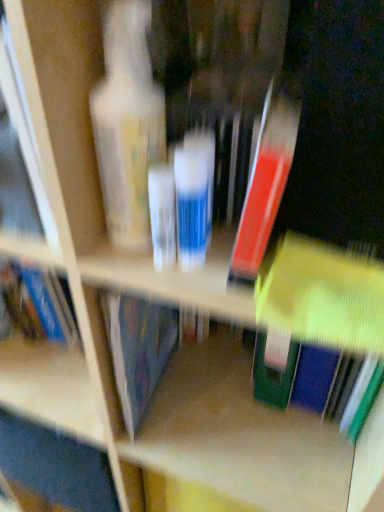
Question: Is matte red book at center, marked as the 2th book in a bottom-to-top arrangement, located outside matte plastic bottle at left?

Choices:
 (A) yes
 (B) no

Answer: (A)

Question: Is matte red book at center, marked as the 2th book in a bottom-to-top arrangement, closer to camera compared to matte plastic bottle at left?

Choices:
 (A) no
 (B) yes

Answer: (B)

Question: Is matte plastic bottle at left inside matte red book at center, marked as the 2th book in a bottom-to-top arrangement?

Choices:
 (A) yes
 (B) no

Answer: (B)

Question: Does matte red book at center, marked as the 2th book in a bottom-to-top arrangement, have a lesser height compared to matte plastic bottle at left?

Choices:
 (A) no
 (B) yes

Answer: (B)

Question: Can you confirm if matte red book at center, marked as the 2th book in a bottom-to-top arrangement, is thinner than matte plastic bottle at left?

Choices:
 (A) no
 (B) yes

Answer: (B)

Question: Looking at their shapes, would you say matte plastic bottle at left is wider or thinner than matte yellow book at center, which appears as the 2th book when viewed from the top?

Choices:
 (A) thin
 (B) wide

Answer: (B)

Question: Is point (69, 251) positioned closer to the camera than point (279, 287)?

Choices:
 (A) closer
 (B) farther

Answer: (B)

Question: From the image's perspective, relative to matte yellow book at center, which appears as the 2th book when viewed from the top, is matte plastic bottle at left above or below?

Choices:
 (A) above
 (B) below

Answer: (A)

Question: From a real-world perspective, is matte plastic bottle at left positioned above or below matte yellow book at center, which appears as the 2th book when viewed from the top?

Choices:
 (A) above
 (B) below

Answer: (A)

Question: From the image's perspective, is translucent plastic tube at center above or below matte yellow book at center, which appears as the 2th book when viewed from the top?

Choices:
 (A) above
 (B) below

Answer: (A)

Question: Looking at their shapes, would you say translucent plastic tube at center is wider or thinner than matte yellow book at center, placed as the 1th book when sorted from bottom to top?

Choices:
 (A) wide
 (B) thin

Answer: (B)

Question: From a real-world perspective, is translucent plastic tube at center above or below matte yellow book at center, which appears as the 2th book when viewed from the top?

Choices:
 (A) below
 (B) above

Answer: (B)

Question: In terms of height, does translucent plastic tube at center look taller or shorter compared to matte yellow book at center, placed as the 1th book when sorted from bottom to top?

Choices:
 (A) tall
 (B) short

Answer: (A)

Question: In terms of height, does matte plastic bottle at left look taller or shorter compared to matte red book at center, marked as the 2th book in a bottom-to-top arrangement?

Choices:
 (A) short
 (B) tall

Answer: (B)

Question: Considering the positions of point (96, 366) and point (278, 192), is point (96, 366) closer or farther from the camera than point (278, 192)?

Choices:
 (A) farther
 (B) closer

Answer: (A)